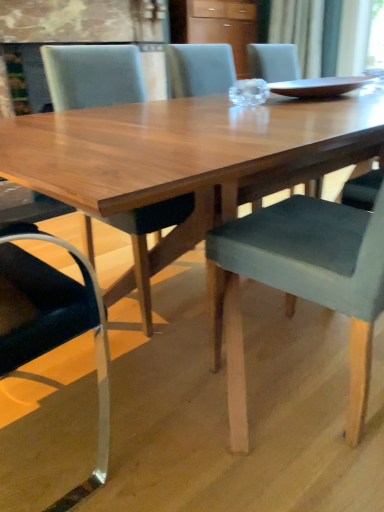
You are a GUI agent. You are given a task and a screenshot of the screen. Output one action in this format:
    pyautogui.click(x=<x>, y=<y>)
    Task: Click on the vacant space underneath velvet grey chair at center, positioned as the second chair in left-to-right order (from a real-world perspective)
    This screenshot has height=512, width=384.
    Given the screenshot: What is the action you would take?
    pyautogui.click(x=304, y=365)